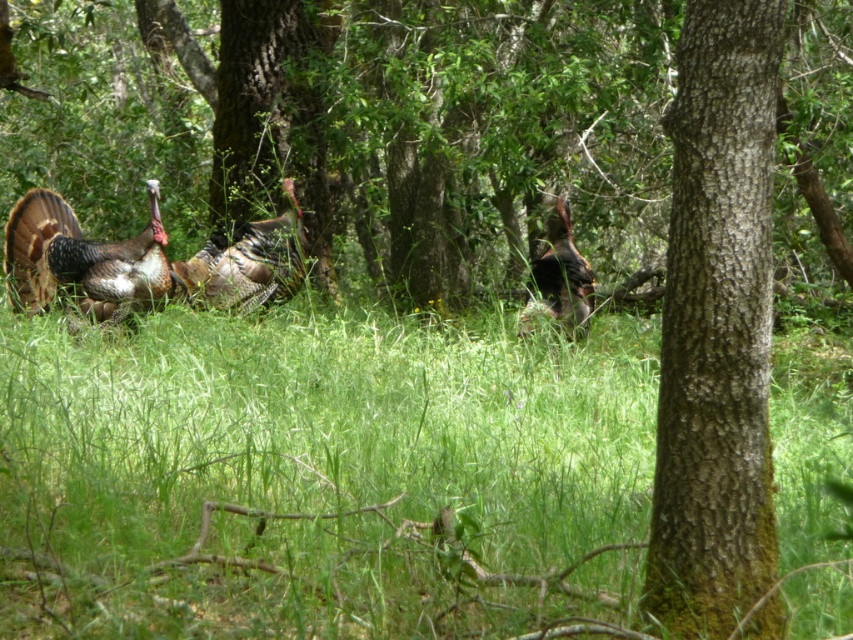
Question: Which of the following is the farthest from the observer?

Choices:
 (A) shiny brown turkey at center
 (B) shiny metallic turkey at center
 (C) green rough bark tree at center
 (D) shiny brown turkey at left

Answer: (B)

Question: From the image, what is the correct spatial relationship of green rough bark tree at center in relation to shiny brown turkey at center?

Choices:
 (A) right
 (B) left

Answer: (B)

Question: Where is green rough bark tree at center located in relation to shiny metallic turkey at center in the image?

Choices:
 (A) below
 (B) above

Answer: (A)

Question: Based on their relative distances, which object is farther from the shiny brown turkey at center?

Choices:
 (A) shiny metallic turkey at center
 (B) shiny brown turkey at left
 (C) green grass at center

Answer: (B)

Question: Estimate the real-world distances between objects in this image. Which object is closer to the shiny brown turkey at left?

Choices:
 (A) shiny brown turkey at center
 (B) shiny metallic turkey at center
 (C) green grass at center
 (D) green rough bark tree at center

Answer: (B)

Question: Can you confirm if shiny brown turkey at left is thinner than shiny brown turkey at center?

Choices:
 (A) yes
 (B) no

Answer: (B)